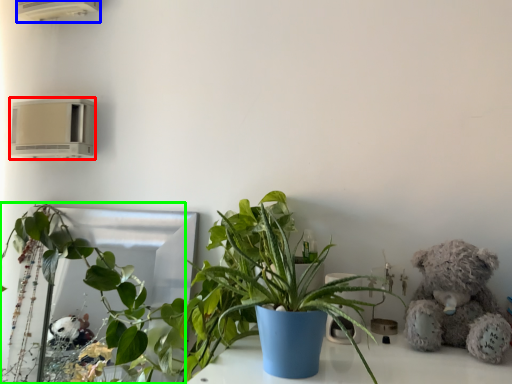
Question: Which object is positioned farthest from air conditioning (highlighted by a red box)? Select from air conditioning (highlighted by a blue box) and houseplant (highlighted by a green box).

Choices:
 (A) air conditioning
 (B) houseplant

Answer: (A)